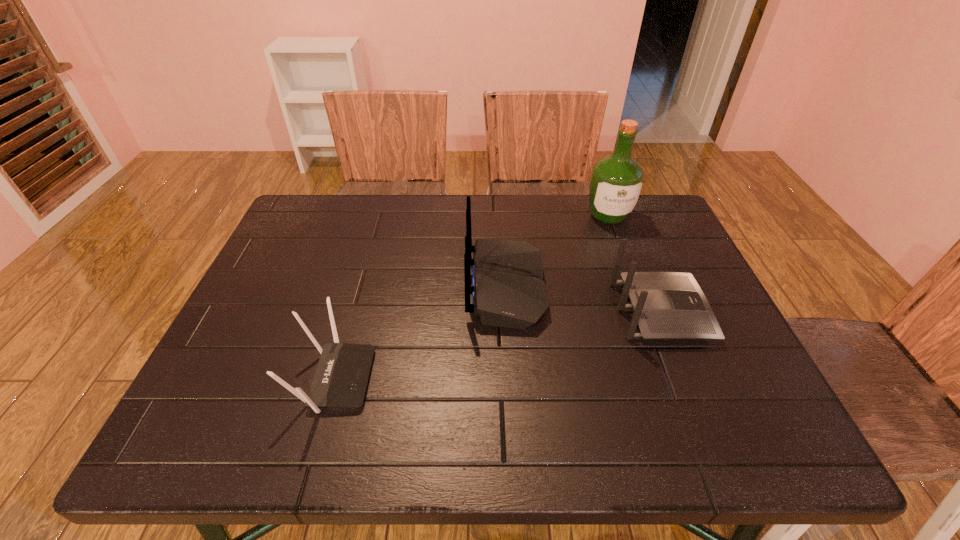
Identify the location of vacant space at the right edge of the desktop. Image resolution: width=960 pixels, height=540 pixels. (659, 254).

What are the coordinates of `vacant space at the far left corner` in the screenshot? It's located at (342, 224).

Locate an element on the screen. The height and width of the screenshot is (540, 960). vacant region at the near right corner is located at coordinates (768, 413).

Find the location of a particular element. This screenshot has height=540, width=960. vacant point located between the rightmost router and the leftmost router is located at coordinates (497, 345).

In order to click on free space between the tallest router and the shortest object in this screenshot , I will do `click(420, 333)`.

Identify the location of vacant point located between the shortest router and the rightmost router. (497, 345).

You are a GUI agent. You are given a task and a screenshot of the screen. Output one action in this format:
    pyautogui.click(x=<x>, y=<y>)
    Task: Click on the vacant space in between the shortest router and the liquor
    This screenshot has width=960, height=540.
    Given the screenshot: What is the action you would take?
    pyautogui.click(x=471, y=297)

This screenshot has width=960, height=540. I want to click on unoccupied area between the rightmost router and the shortest router, so click(497, 345).

Where is `unoccupied area between the third object from right to left and the leftmost object`? Image resolution: width=960 pixels, height=540 pixels. unoccupied area between the third object from right to left and the leftmost object is located at coordinates (420, 333).

At what (x,y) coordinates should I click in order to perform the action: click on vacant area that lies between the second tallest object and the rightmost router. Please return your answer as a coordinate pair (x, y). The image size is (960, 540). Looking at the image, I should click on (584, 299).